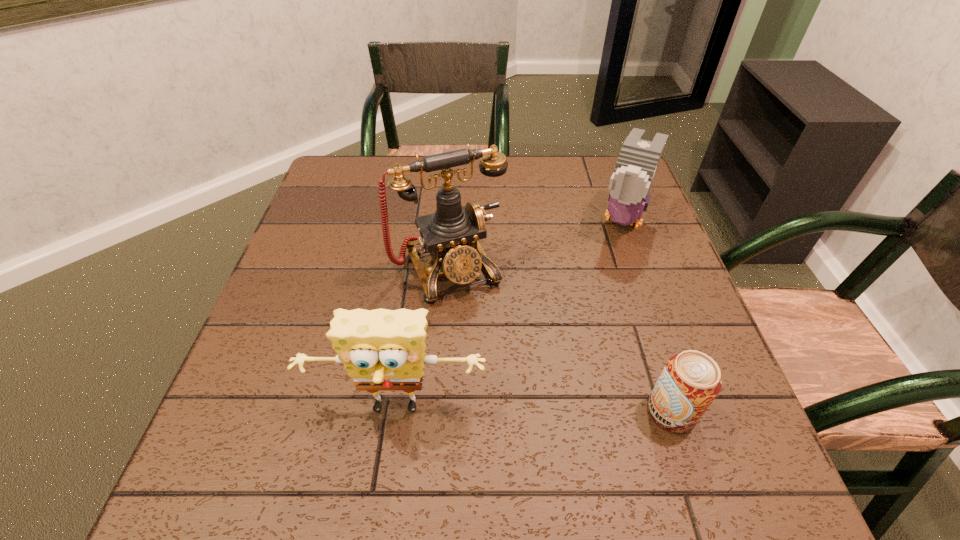
Find the location of a particular element. This screenshot has height=540, width=960. free region located on the front of the tallest object, featuring the rotary dial is located at coordinates (513, 395).

Identify the location of object at the far edge. This screenshot has height=540, width=960. (638, 160).

Image resolution: width=960 pixels, height=540 pixels. In order to click on sponge situated at the near edge in this screenshot , I will do `click(383, 350)`.

I want to click on beer can that is positioned at the near edge, so click(x=690, y=381).

Where is `object located in the left edge section of the desktop`? This screenshot has width=960, height=540. object located in the left edge section of the desktop is located at coordinates (383, 350).

The height and width of the screenshot is (540, 960). Identify the location of beer can that is at the right edge. (690, 381).

Where is `bird that is positioned at the right edge`? bird that is positioned at the right edge is located at coordinates (638, 160).

Locate an element on the screen. object located at the near left corner is located at coordinates (383, 350).

Where is `object that is at the far right corner`? object that is at the far right corner is located at coordinates (638, 160).

Locate an element on the screen. This screenshot has height=540, width=960. object that is at the near right corner is located at coordinates (690, 381).